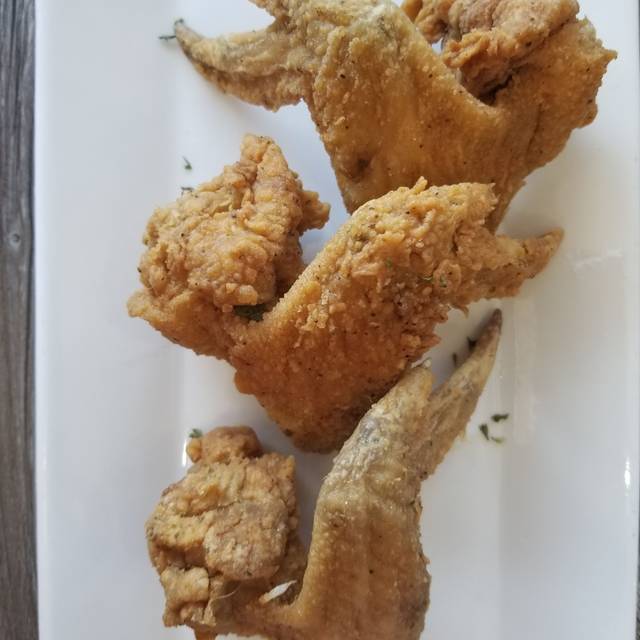
This screenshot has height=640, width=640. In order to click on wood grain in this screenshot , I will do `click(15, 121)`, `click(17, 281)`.